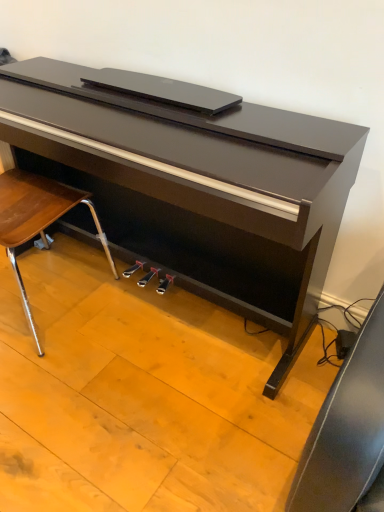
Locate an element on the screen. wooden/matte chair at lower left is located at coordinates (37, 219).

Based on the photo, what is the approximate width of wooden/matte chair at lower left?

wooden/matte chair at lower left is 23.33 inches wide.

What do you see at coordinates (37, 219) in the screenshot?
I see `wooden/matte chair at lower left` at bounding box center [37, 219].

Identify the location of wooden/matte chair at lower left. Image resolution: width=384 pixels, height=512 pixels. (37, 219).